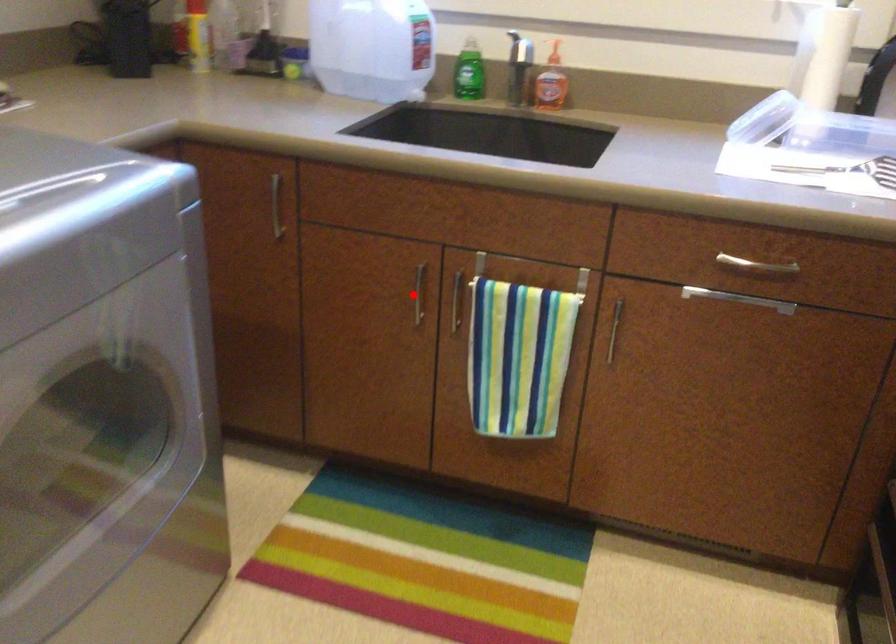
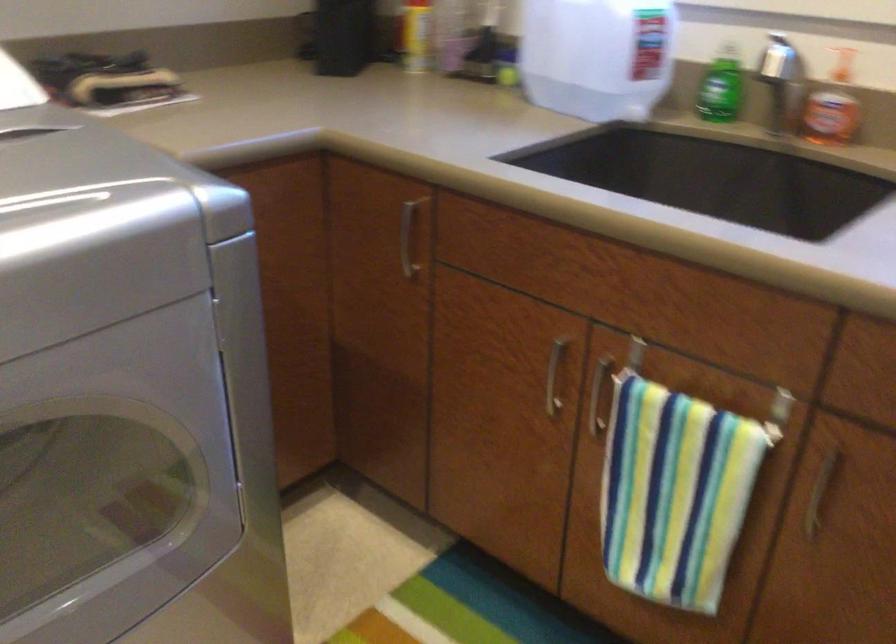
Question: A red point is marked in image1. In image2, is the corresponding 3D point closer to the camera or farther? Reply with the corresponding letter.

Choices:
 (A) The corresponding 3D point is closer.
 (B) The corresponding 3D point is farther.

Answer: (A)